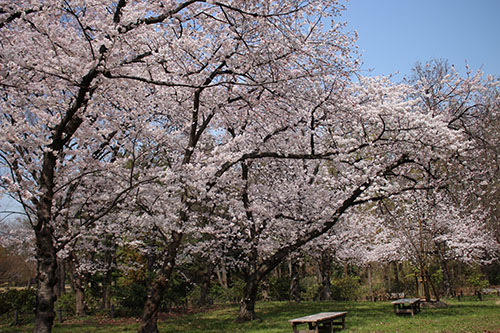
This screenshot has width=500, height=333. I want to click on wooden benches, so click(x=387, y=294), click(x=473, y=291).